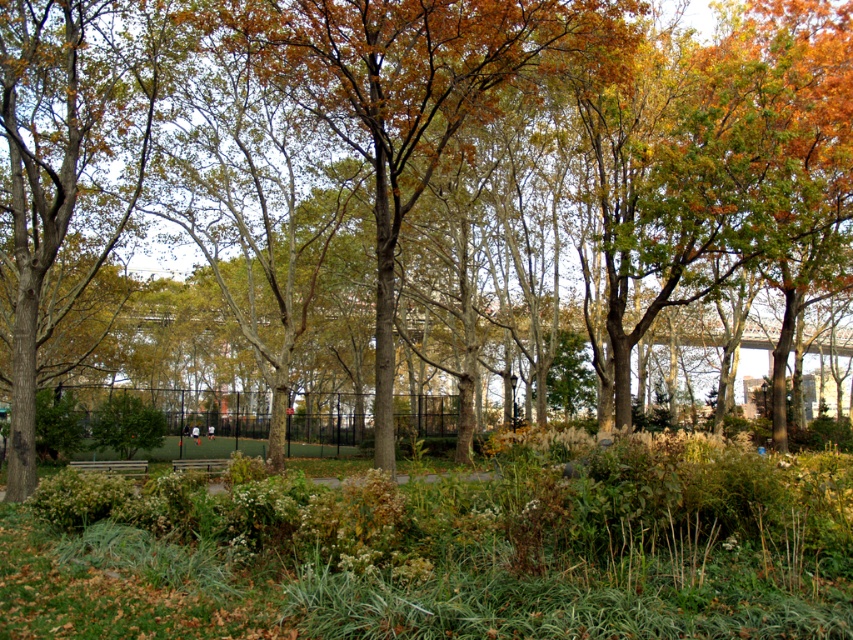
Can you confirm if wooden bench at lower left is shorter than wooden bench at center?

Yes, wooden bench at lower left is shorter than wooden bench at center.

Is point (131, 467) positioned behind point (187, 460)?

No, it is in front of (187, 460).

What do you see at coordinates (113, 467) in the screenshot? This screenshot has width=853, height=640. I see `wooden bench at lower left` at bounding box center [113, 467].

You are a GUI agent. You are given a task and a screenshot of the screen. Output one action in this format:
    pyautogui.click(x=<x>, y=<y>)
    Task: Click on the wooden bench at lower left
    The image size is (853, 640).
    Given the screenshot: What is the action you would take?
    pyautogui.click(x=113, y=467)

Is point (750, 532) farther from viewer compared to point (181, 468)?

That is False.

From the picture: Who is lower down, green grass at center or wooden bench at center?

wooden bench at center is lower down.

Identify the location of green grass at center. The height and width of the screenshot is (640, 853). (448, 547).

The image size is (853, 640). I want to click on green grass at center, so click(x=448, y=547).

Looking at this image, between brown rough tree at lower left and wooden bench at lower left, which one is positioned higher?

brown rough tree at lower left is higher up.

Can you confirm if brown rough tree at lower left is taller than wooden bench at lower left?

Yes.

Which is behind, point (97, 116) or point (119, 472)?

Positioned behind is point (119, 472).

You are a GUI agent. You are given a task and a screenshot of the screen. Output one action in this format:
    pyautogui.click(x=<x>, y=<y>)
    Task: Click on the brown rough tree at lower left
    
    Given the screenshot: What is the action you would take?
    pyautogui.click(x=65, y=168)